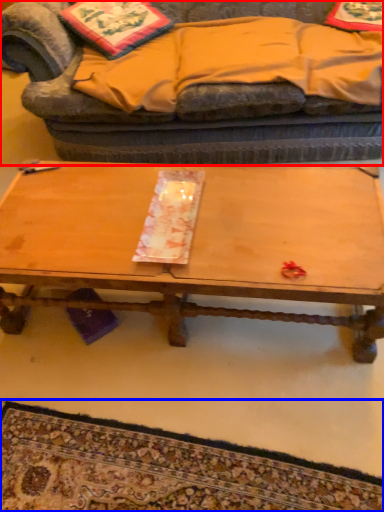
Question: Which of the following is the closest to the observer, studio couch (highlighted by a red box) or mat (highlighted by a blue box)?

Choices:
 (A) studio couch
 (B) mat

Answer: (B)